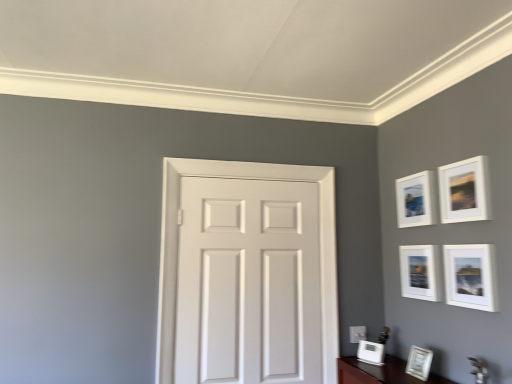
Question: Considering the positions of white matte picture frame at upper right, the fourth picture frame in the bottom-to-top sequence, and white glossy picture frame at lower right, which ranks as the first picture frame in bottom-to-top order, in the image, is white matte picture frame at upper right, the fourth picture frame in the bottom-to-top sequence, taller or shorter than white glossy picture frame at lower right, which ranks as the first picture frame in bottom-to-top order,?

Choices:
 (A) tall
 (B) short

Answer: (A)

Question: Is point (460, 302) closer or farther from the camera than point (377, 360)?

Choices:
 (A) farther
 (B) closer

Answer: (B)

Question: Considering the real-world distances, which object is closest to the matte white picture frame at upper right, marked as the sixth picture frame in a bottom-to-top arrangement?

Choices:
 (A) white matte door at center
 (B) white matte picture frame at upper right, which is counted as the 3th picture frame, starting from the bottom
 (C) white glossy picture frame at lower right, the fifth picture frame in the top-to-bottom sequence
 (D) white matte picture frame at upper right, the 3th picture frame positioned from the top
 (E) white glossy picture frame at lower right, which ranks as the first picture frame in bottom-to-top order

Answer: (D)

Question: Estimate the real-world distances between objects in this image. Which object is closer to the matte white picture frame at upper right, marked as the sixth picture frame in a bottom-to-top arrangement?

Choices:
 (A) white matte picture frame at upper right, the 4th picture frame in the top-to-bottom sequence
 (B) white matte picture frame at upper right, the 3th picture frame positioned from the top
 (C) white glossy picture frame at lower right, which ranks as the first picture frame in bottom-to-top order
 (D) white glossy picture frame at lower right, the fifth picture frame in the top-to-bottom sequence
 (E) matte white picture frame at upper right, which ranks as the second picture frame in top-to-bottom order

Answer: (E)